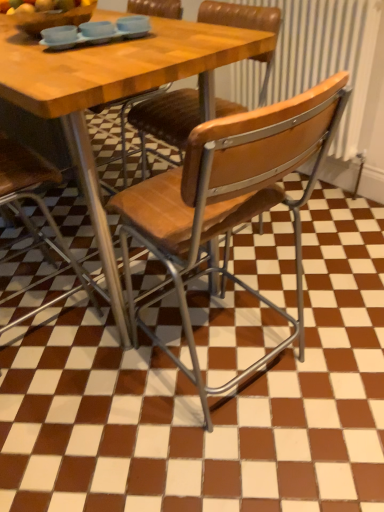
Image resolution: width=384 pixels, height=512 pixels. Find the location of `wooden seat at center, marked as the 3th chair in a right-to-left arrangement`. wooden seat at center, marked as the 3th chair in a right-to-left arrangement is located at coordinates (40, 209).

The width and height of the screenshot is (384, 512). What do you see at coordinates (95, 32) in the screenshot?
I see `matte blue tray at upper center` at bounding box center [95, 32].

Find the location of `wooden seat at center, positioned as the first chair in right-to-left order`. wooden seat at center, positioned as the first chair in right-to-left order is located at coordinates (227, 204).

The image size is (384, 512). In order to click on wooden seat at center, positioned as the 1th chair in left-to-right order in this screenshot , I will do `click(40, 209)`.

Which of these two, wooden seat at center, marked as the 3th chair in a right-to-left arrangement, or wooden seat at center, positioned as the second chair in right-to-left order, is smaller?

wooden seat at center, marked as the 3th chair in a right-to-left arrangement, is smaller.

Do you think wooden seat at center, marked as the 3th chair in a right-to-left arrangement, is within wooden seat at center, positioned as the second chair in right-to-left order, or outside of it?

wooden seat at center, marked as the 3th chair in a right-to-left arrangement, is located beyond the bounds of wooden seat at center, positioned as the second chair in right-to-left order.

From the image's perspective, does wooden seat at center, marked as the 3th chair in a right-to-left arrangement, appear higher than wooden seat at center, which is the 2th chair in left-to-right order?

No, from the image's perspective, wooden seat at center, marked as the 3th chair in a right-to-left arrangement, is not on top of wooden seat at center, which is the 2th chair in left-to-right order.

How far apart are wooden chair at center and wooden bowl at upper left?

wooden chair at center and wooden bowl at upper left are 1.17 meters apart.

Looking at this image, does wooden chair at center touch wooden bowl at upper left?

No, wooden chair at center is not making contact with wooden bowl at upper left.

Which is closer to the camera, (359, 487) or (66, 0)?

Positioned in front is point (359, 487).

Considering the positions of objects wooden chair at center and wooden bowl at upper left in the image provided, who is in front, wooden chair at center or wooden bowl at upper left?

wooden chair at center is closer to the camera.

Are matte blue tray at upper center and wooden bowl at upper left beside each other?

matte blue tray at upper center and wooden bowl at upper left are not in contact.

This screenshot has height=512, width=384. I want to click on tableware that appears in front of the wooden bowl at upper left, so click(x=95, y=32).

Who is bigger, matte blue tray at upper center or wooden bowl at upper left?

wooden bowl at upper left.

Is matte blue tray at upper center spatially inside wooden bowl at upper left, or outside of it?

matte blue tray at upper center lies outside wooden bowl at upper left.

In terms of width, does wooden chair at center look wider or thinner when compared to wooden seat at center, positioned as the first chair in right-to-left order?

Considering their sizes, wooden chair at center looks broader than wooden seat at center, positioned as the first chair in right-to-left order.

Based on the photo, is wooden chair at center closer to camera compared to wooden seat at center, the third chair when ordered from left to right?

No, wooden chair at center is further to the viewer.

Would you say wooden chair at center is outside wooden seat at center, the third chair when ordered from left to right?

wooden chair at center is positioned outside wooden seat at center, the third chair when ordered from left to right.

Is wooden seat at center, the third chair when ordered from left to right, with matte blue tray at upper center?

No, wooden seat at center, the third chair when ordered from left to right, is not beside matte blue tray at upper center.

Measure the distance between wooden seat at center, the third chair when ordered from left to right, and matte blue tray at upper center.

wooden seat at center, the third chair when ordered from left to right, is 25.96 inches away from matte blue tray at upper center.

From a real-world perspective, does wooden seat at center, the third chair when ordered from left to right, stand above matte blue tray at upper center?

No.

Does point (135, 194) come behind point (135, 28)?

No.

Is point (66, 0) positioned behind point (223, 23)?

No.

Is wooden bowl at upper left inside the boundaries of wooden seat at center, positioned as the second chair in right-to-left order, or outside?

wooden bowl at upper left is outside wooden seat at center, positioned as the second chair in right-to-left order.

Looking at this image, from a real-world perspective, between wooden bowl at upper left and wooden seat at center, which is the 2th chair in left-to-right order, who is vertically higher?

wooden bowl at upper left is physically above.

Is the depth of wooden bowl at upper left greater than that of wooden seat at center, which is the 2th chair in left-to-right order?

No, wooden bowl at upper left is in front of wooden seat at center, which is the 2th chair in left-to-right order.

Would you say wooden bowl at upper left is inside or outside matte blue tray at upper center?

wooden bowl at upper left is located beyond the bounds of matte blue tray at upper center.

Is wooden bowl at upper left far from matte blue tray at upper center?

No, there isn't a large distance between wooden bowl at upper left and matte blue tray at upper center.

From a real-world perspective, is wooden bowl at upper left on top of matte blue tray at upper center?

Yes, from a real-world perspective, wooden bowl at upper left is on top of matte blue tray at upper center.

From the image's perspective, which is above, wooden bowl at upper left or matte blue tray at upper center?

wooden bowl at upper left is shown above in the image.

Where is `chair above the wooden seat at center, marked as the 3th chair in a right-to-left arrangement (from the image's perspective)`? chair above the wooden seat at center, marked as the 3th chair in a right-to-left arrangement (from the image's perspective) is located at coordinates coord(168,116).

This screenshot has height=512, width=384. In order to click on fruit dish that appears on the left of wooden chair at center in this screenshot , I will do `click(47, 13)`.

Based on their spatial positions, is wooden seat at center, which is the 2th chair in left-to-right order, or wooden bowl at upper left closer to matte blue tray at upper center?

wooden bowl at upper left lies closer to matte blue tray at upper center than the other object.

Which object lies nearer to the anchor point wooden chair at center, wooden seat at center, the third chair when ordered from left to right, or wooden seat at center, which is the 2th chair in left-to-right order?

wooden seat at center, the third chair when ordered from left to right, is positioned closer to the anchor wooden chair at center.

In the scene shown: Considering their positions, is wooden bowl at upper left positioned closer to wooden seat at center, marked as the 3th chair in a right-to-left arrangement, than wooden chair at center?

wooden chair at center is positioned closer to the anchor wooden seat at center, marked as the 3th chair in a right-to-left arrangement.

Based on their spatial positions, is wooden seat at center, marked as the 3th chair in a right-to-left arrangement, or matte blue tray at upper center closer to wooden bowl at upper left?

matte blue tray at upper center is positioned closer to the anchor wooden bowl at upper left.

Considering their positions, is wooden seat at center, positioned as the 1th chair in left-to-right order, positioned closer to wooden chair at center than matte blue tray at upper center?

wooden seat at center, positioned as the 1th chair in left-to-right order, is positioned closer to the anchor wooden chair at center.

Looking at the image, which one is located further to wooden seat at center, marked as the 3th chair in a right-to-left arrangement, wooden seat at center, positioned as the second chair in right-to-left order, or wooden seat at center, positioned as the first chair in right-to-left order?

Among the two, wooden seat at center, positioned as the second chair in right-to-left order, is located further to wooden seat at center, marked as the 3th chair in a right-to-left arrangement.

Looking at the image, which one is located closer to wooden bowl at upper left, wooden seat at center, positioned as the second chair in right-to-left order, or matte blue tray at upper center?

Among the two, matte blue tray at upper center is located nearer to wooden bowl at upper left.

Looking at the image, which one is located closer to wooden seat at center, marked as the 3th chair in a right-to-left arrangement, wooden chair at center or matte blue tray at upper center?

wooden chair at center.

Image resolution: width=384 pixels, height=512 pixels. What are the coordinates of `fruit dish between wooden seat at center, positioned as the 1th chair in left-to-right order, and wooden seat at center, which is the 2th chair in left-to-right order, from left to right` in the screenshot? It's located at (x=47, y=13).

The height and width of the screenshot is (512, 384). Find the location of `tableware located between wooden seat at center, positioned as the 1th chair in left-to-right order, and wooden seat at center, positioned as the second chair in right-to-left order, in the left-right direction`. tableware located between wooden seat at center, positioned as the 1th chair in left-to-right order, and wooden seat at center, positioned as the second chair in right-to-left order, in the left-right direction is located at coordinates (95, 32).

Where is `tile between wooden bowl at upper left and wooden seat at center, the third chair when ordered from left to right, from top to bottom`? tile between wooden bowl at upper left and wooden seat at center, the third chair when ordered from left to right, from top to bottom is located at coordinates (208, 400).

Find the location of a particular element. The width and height of the screenshot is (384, 512). tableware between wooden seat at center, positioned as the 1th chair in left-to-right order, and wooden seat at center, the third chair when ordered from left to right, from left to right is located at coordinates (95, 32).